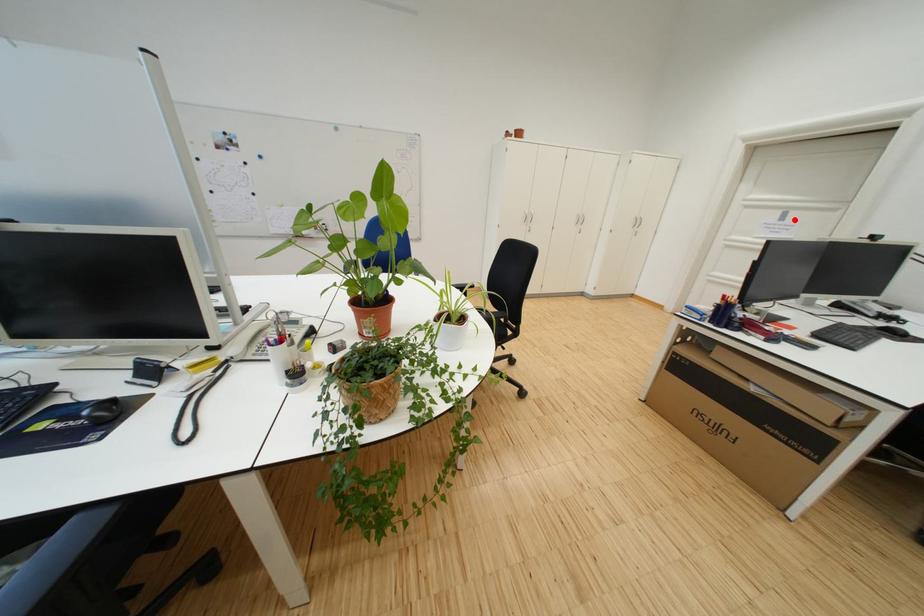
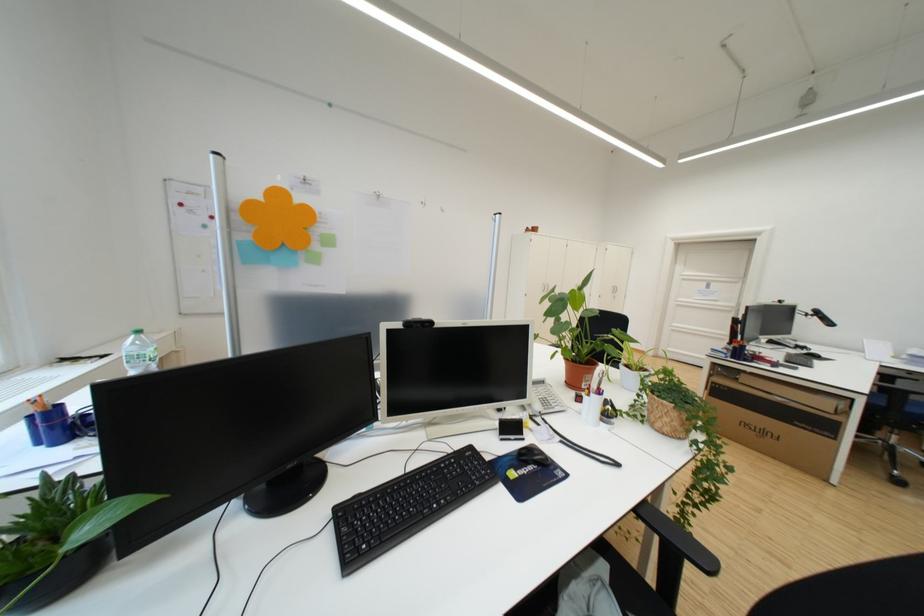
Where in the second image is the point corresponding to the highlighted location from the first image?

(720, 288)